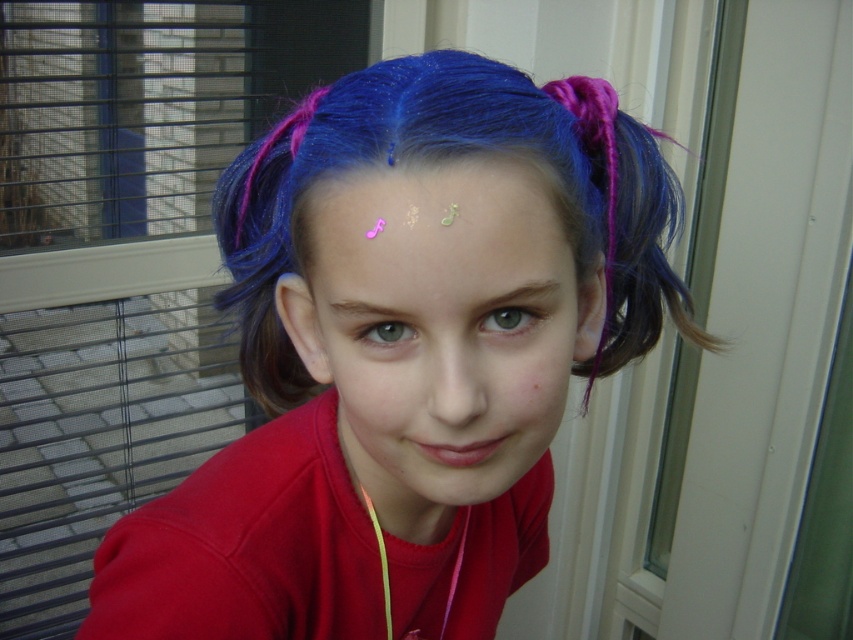
You are an artist trying to paint the scene. You need to place a sticker exactly at the center of the image. However, there is already a pink glitter music notes at center at coordinates 0.356, 0.508. Is the music notes sticker positioned exactly at the center of the image?

The pink glitter music notes at center is located at point (432, 227), which is not exactly the center of the image. The true center would be at coordinates (426, 320), so the sticker is slightly to the left and below the exact center.